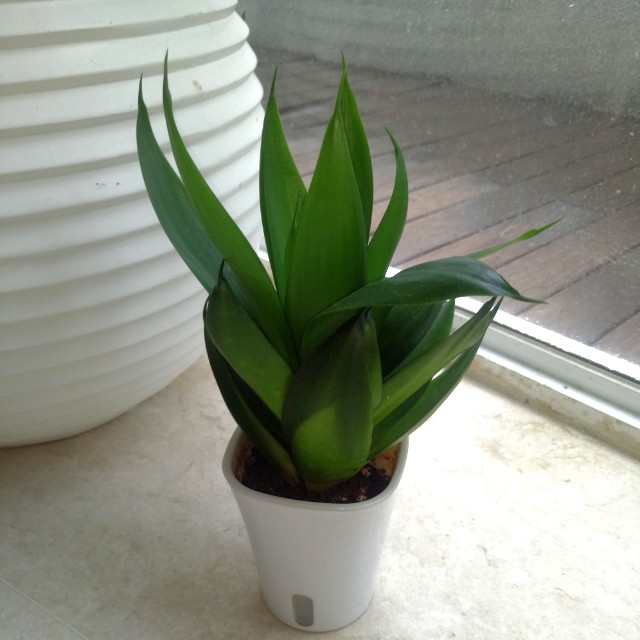
You are a GUI agent. You are given a task and a screenshot of the screen. Output one action in this format:
    pyautogui.click(x=<x>, y=<y>)
    Task: Click on the white pot
    The height and width of the screenshot is (640, 640).
    Given the screenshot: What is the action you would take?
    pyautogui.click(x=342, y=541)